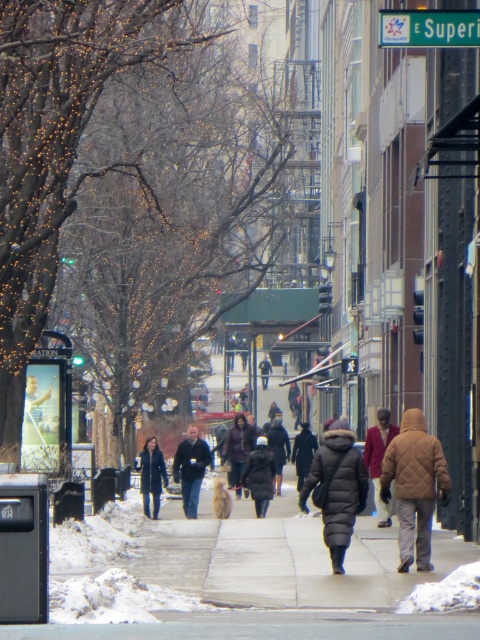
Question: Which point is closer to the camera taking this photo?

Choices:
 (A) (263, 476)
 (B) (330, 488)
 (C) (192, 481)
 (D) (250, 440)

Answer: (B)

Question: Considering the relative positions of maroon fabric coat at center and dark blue coat at center in the image provided, where is maroon fabric coat at center located with respect to dark blue coat at center?

Choices:
 (A) left
 (B) right

Answer: (B)

Question: Estimate the real-world distances between objects in this image. Which object is farther from the green plastic street sign at upper center?

Choices:
 (A) dark blue coat at center
 (B) dark brown leather jacket at center
 (C) maroon fabric coat at center

Answer: (B)

Question: Is brown quilted jacket at center-right above black puffy coat at center?

Choices:
 (A) no
 (B) yes

Answer: (B)

Question: From the image, what is the correct spatial relationship of green plastic street sign at upper center in relation to dark brown fur coat at center?

Choices:
 (A) below
 (B) above

Answer: (B)

Question: Which of the following is the farthest from the observer?

Choices:
 (A) black puffy coat at center
 (B) dark blue jacket at center

Answer: (B)